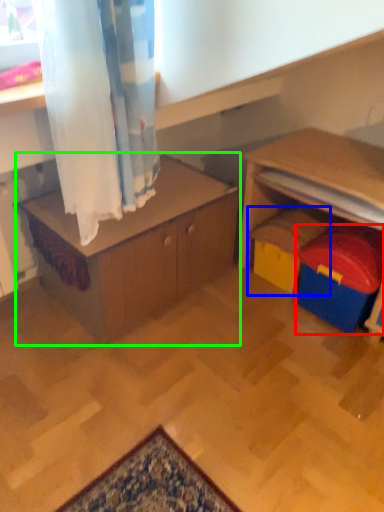
Question: Which is nearer to the toy (highlighted by a red box)? toy (highlighted by a blue box) or table (highlighted by a green box).

Choices:
 (A) toy
 (B) table

Answer: (A)